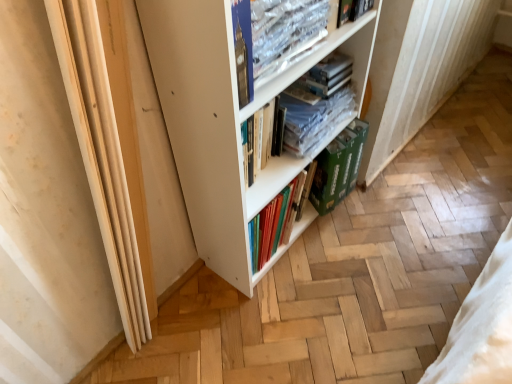
Question: Considering the relative sizes of clear plastic book at upper center, acting as the 3th book starting from the back, and white matte bookcase at center in the image provided, is clear plastic book at upper center, acting as the 3th book starting from the back, bigger than white matte bookcase at center?

Choices:
 (A) no
 (B) yes

Answer: (A)

Question: Is clear plastic book at upper center, which is the 1th book in front-to-back order, to the right of white matte bookcase at center from the viewer's perspective?

Choices:
 (A) yes
 (B) no

Answer: (A)

Question: Is clear plastic book at upper center, which is the 1th book in front-to-back order, not inside white matte bookcase at center?

Choices:
 (A) no
 (B) yes

Answer: (A)

Question: Can you confirm if clear plastic book at upper center, which is the 1th book in front-to-back order, is thinner than white matte bookcase at center?

Choices:
 (A) no
 (B) yes

Answer: (B)

Question: From a real-world perspective, is clear plastic book at upper center, which is the 1th book in front-to-back order, located beneath white matte bookcase at center?

Choices:
 (A) yes
 (B) no

Answer: (B)

Question: Considering the positions of clear plastic book at upper center, which is the 1th book in front-to-back order, and green cardboard box at lower center in the image, is clear plastic book at upper center, which is the 1th book in front-to-back order, wider or thinner than green cardboard box at lower center?

Choices:
 (A) thin
 (B) wide

Answer: (A)

Question: From a real-world perspective, is clear plastic book at upper center, which is the 1th book in front-to-back order, above or below green cardboard box at lower center?

Choices:
 (A) above
 (B) below

Answer: (A)

Question: From the image's perspective, is clear plastic book at upper center, which is the 1th book in front-to-back order, located above or below green cardboard box at lower center?

Choices:
 (A) below
 (B) above

Answer: (B)

Question: Is clear plastic book at upper center, acting as the 3th book starting from the back, spatially inside green cardboard box at lower center, or outside of it?

Choices:
 (A) inside
 (B) outside

Answer: (B)

Question: In the image, is clear plastic books at center, the 3th book from the front, positioned in front of or behind hardcover book at upper center, marked as the 2th book in a front-to-back arrangement?

Choices:
 (A) behind
 (B) front

Answer: (A)

Question: Based on their sizes in the image, would you say clear plastic books at center, acting as the first book starting from the back, is bigger or smaller than hardcover book at upper center, marked as the 2th book in a front-to-back arrangement?

Choices:
 (A) big
 (B) small

Answer: (A)

Question: Is clear plastic books at center, the 3th book from the front, wider or thinner than hardcover book at upper center, marked as the 2th book in a front-to-back arrangement?

Choices:
 (A) wide
 (B) thin

Answer: (A)

Question: Considering the positions of point (278, 132) and point (367, 1), is point (278, 132) closer or farther from the camera than point (367, 1)?

Choices:
 (A) closer
 (B) farther

Answer: (B)

Question: Relative to clear plastic book at upper center, which is the 1th book in front-to-back order, is green cardboard box at lower center in front or behind?

Choices:
 (A) behind
 (B) front

Answer: (A)

Question: Considering the positions of green cardboard box at lower center and clear plastic book at upper center, which is the 1th book in front-to-back order, in the image, is green cardboard box at lower center wider or thinner than clear plastic book at upper center, which is the 1th book in front-to-back order,?

Choices:
 (A) wide
 (B) thin

Answer: (A)